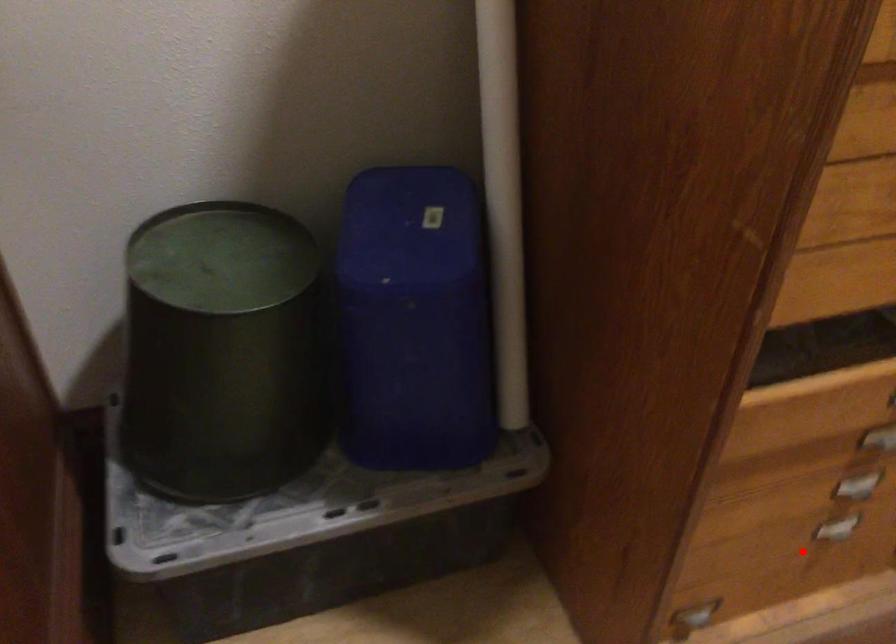
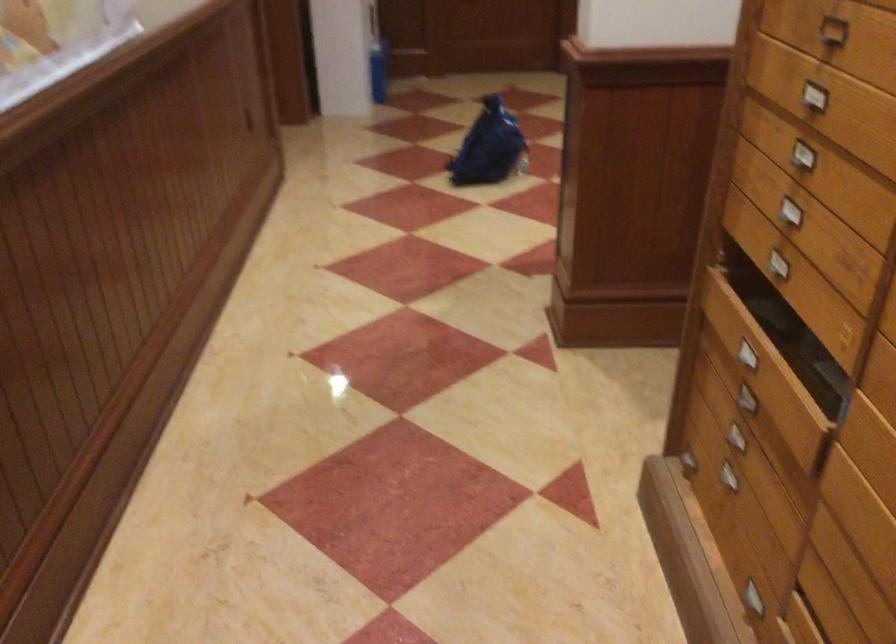
The point at the highlighted location is marked in the first image. Where is the corresponding point in the second image?

(725, 476)